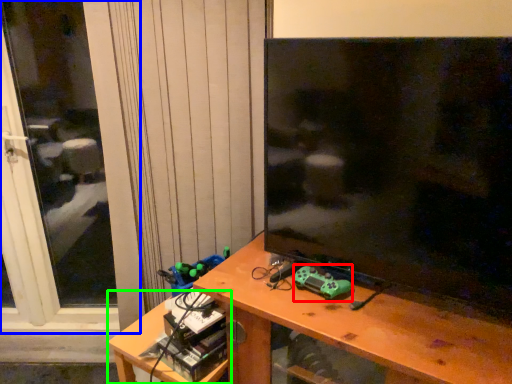
Question: Which object is the closest to the toy (highlighted by a red box)? Choose among these: screen door (highlighted by a blue box) or table (highlighted by a green box).

Choices:
 (A) screen door
 (B) table

Answer: (B)